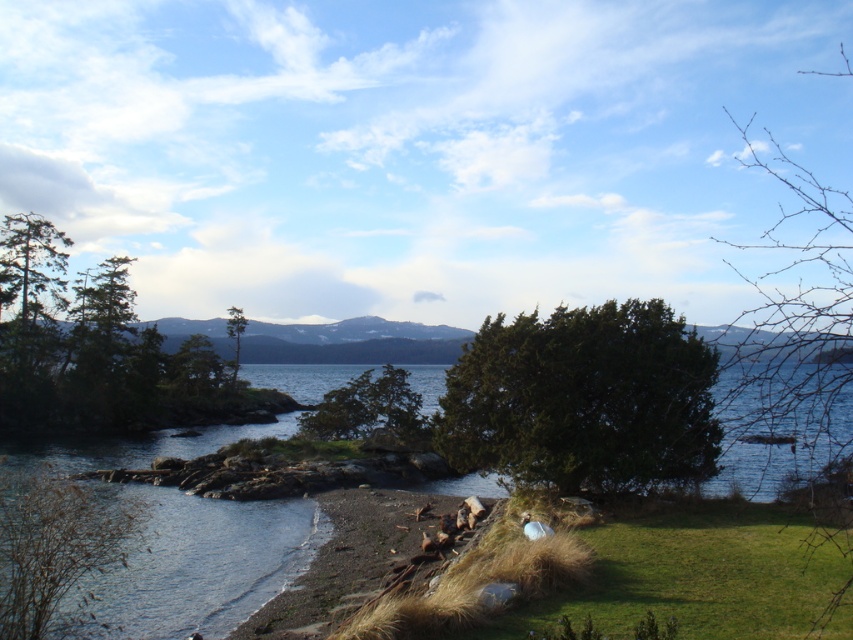
You are standing at the edge of the grassy area in the coastal landscape. You want to place a picnic blanket near the brown textured tree at lower left. If the blanket is 2 meters long, will it fit entirely within the grassy area without reaching the rocky shoreline?

The brown textured tree at lower left is 8.84 meters away from the viewer. Since the picnic blanket is only 2 meters long, placing it near the tree would keep it well within the grassy area and away from the rocky shoreline.

You are standing at the point with coordinates (x=799, y=305) in the coastal landscape. What object is located exactly at that point?

The green leafy tree at upper right is located exactly at point (x=799, y=305).